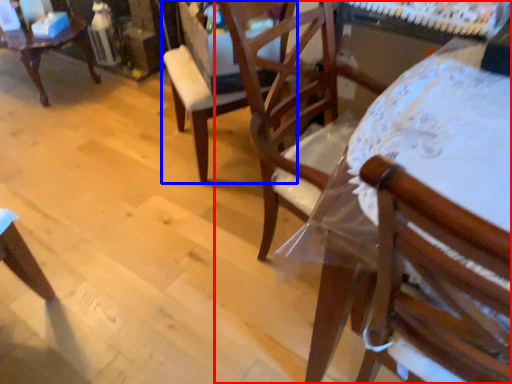
Question: Among these objects, which one is farthest to the camera, chair (highlighted by a red box) or chair (highlighted by a blue box)?

Choices:
 (A) chair
 (B) chair

Answer: (B)